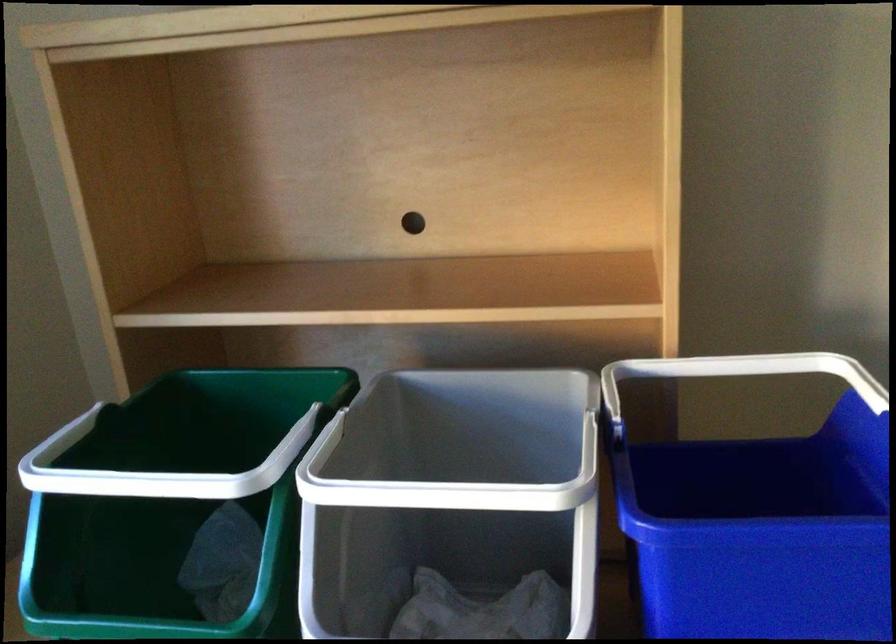
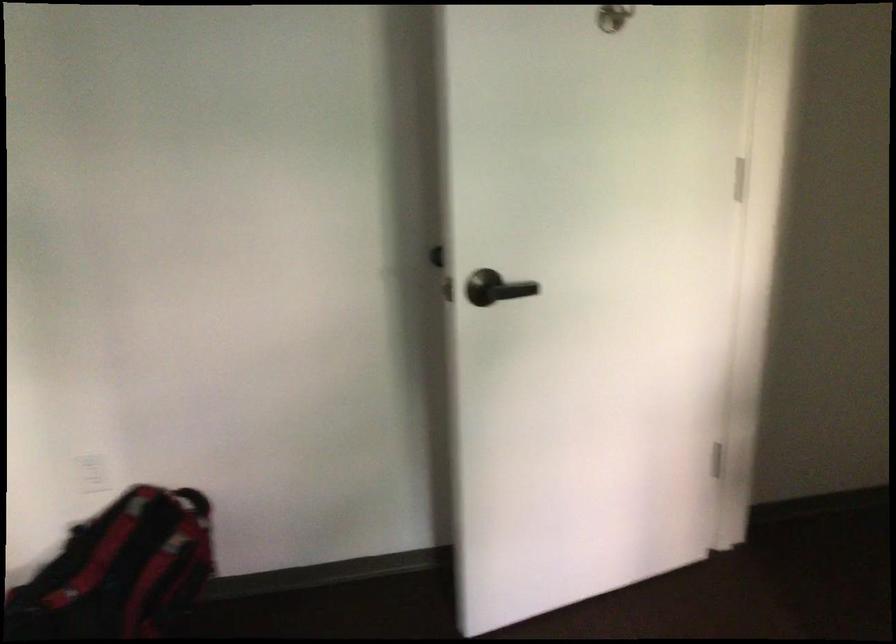
The first image is from the beginning of the video and the second image is from the end. How did the camera likely rotate when shooting the video?

The camera rotated toward right-down.